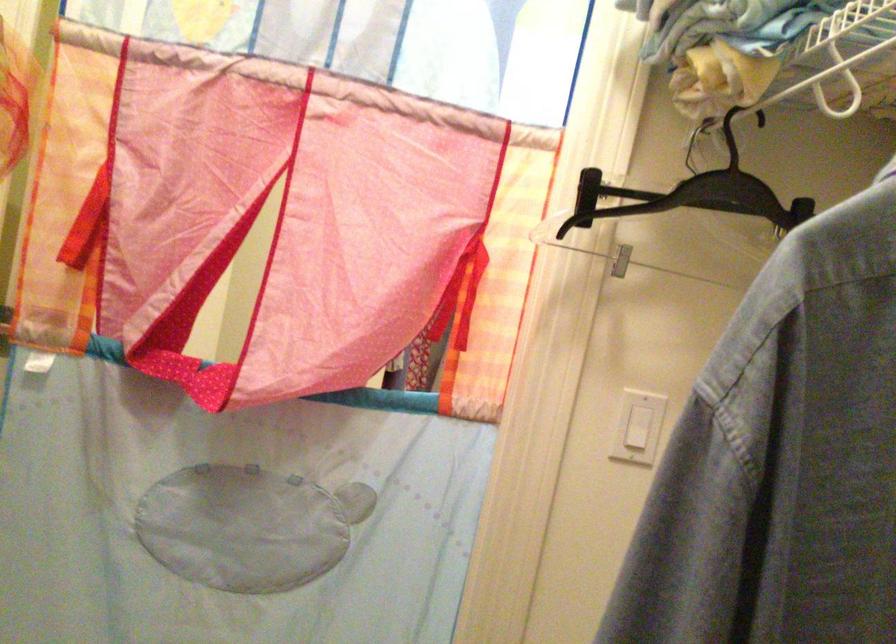
Where is `white light switch`? Image resolution: width=896 pixels, height=644 pixels. white light switch is located at coordinates (638, 427).